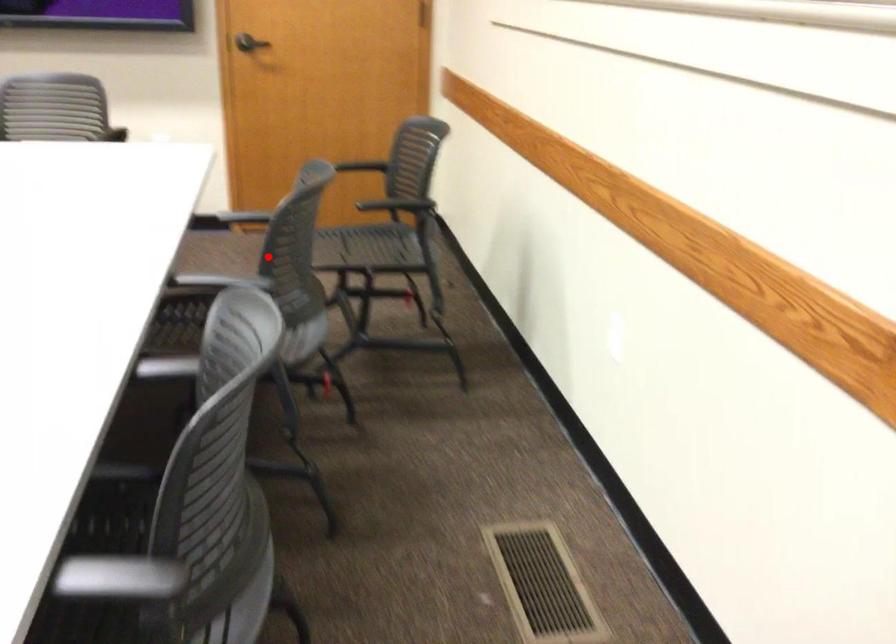
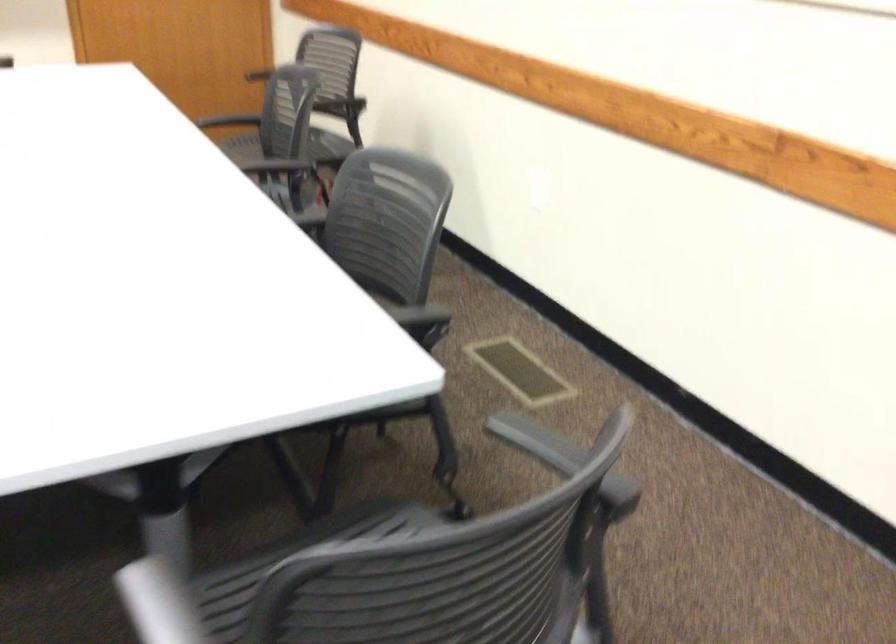
In the second image, find the point that corresponds to the highlighted location in the first image.

(294, 144)